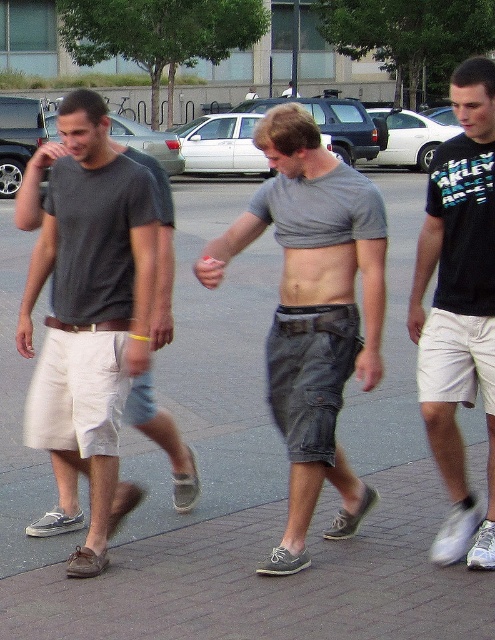
Question: Does gray concrete pavement at center appear on the left side of matte gray t-shirt at left?

Choices:
 (A) yes
 (B) no

Answer: (B)

Question: Based on their relative distances, which object is farther from the gray concrete pavement at center?

Choices:
 (A) matte gray t-shirt at left
 (B) gray cotton shorts at center
 (C) black cotton t-shirt at center

Answer: (B)

Question: From the image, what is the correct spatial relationship of gray cotton shorts at center in relation to black cotton t-shirt at center?

Choices:
 (A) right
 (B) left

Answer: (B)

Question: Can you confirm if gray cotton shorts at center is positioned to the right of matte gray t-shirt at left?

Choices:
 (A) yes
 (B) no

Answer: (A)

Question: Which object is the farthest from the black cotton t-shirt at center?

Choices:
 (A) matte gray t-shirt at left
 (B) gray concrete pavement at center
 (C) gray cotton shorts at center

Answer: (B)

Question: Which of the following is the closest to the observer?

Choices:
 (A) (117, 276)
 (B) (313, 179)
 (C) (412, 438)
 (D) (465, 224)

Answer: (D)